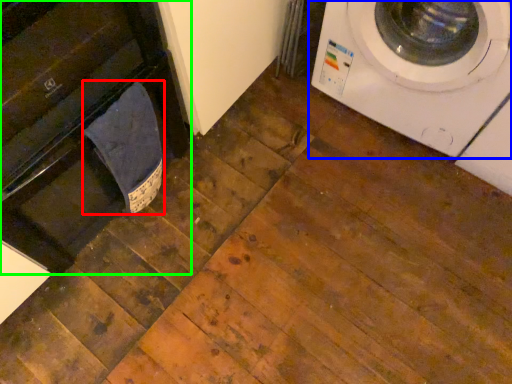
Question: Considering the real-world distances, which object is closest to laundry (highlighted by a red box)? washing machine (highlighted by a blue box) or dish washer (highlighted by a green box).

Choices:
 (A) washing machine
 (B) dish washer

Answer: (B)